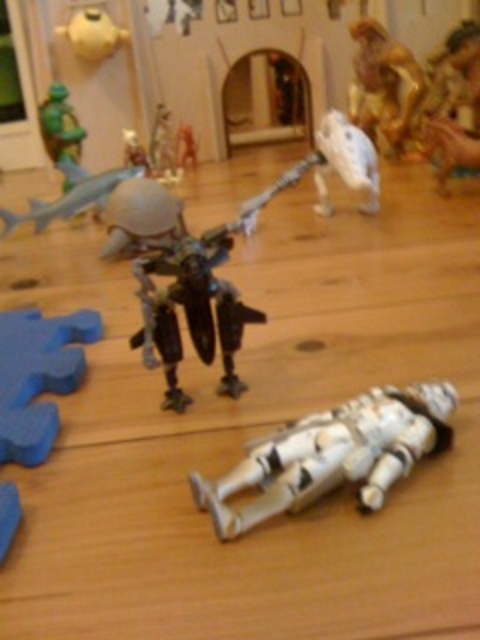
Is white matte elephant at upper center to the right of blue matte shark at upper left from the viewer's perspective?

Indeed, white matte elephant at upper center is positioned on the right side of blue matte shark at upper left.

Measure the distance between point (359, 131) and camera.

The distance of point (359, 131) from camera is 1.34 meters.

Does point (316, 180) come closer to viewer compared to point (16, 221)?

That is False.

The height and width of the screenshot is (640, 480). I want to click on white matte elephant at upper center, so click(x=346, y=163).

Between gold metallic statue at upper right and blue matte shark at upper left, which one is positioned higher?

gold metallic statue at upper right is higher up.

Can you confirm if gold metallic statue at upper right is positioned to the right of blue matte shark at upper left?

Correct, you'll find gold metallic statue at upper right to the right of blue matte shark at upper left.

This screenshot has width=480, height=640. What do you see at coordinates (386, 92) in the screenshot?
I see `gold metallic statue at upper right` at bounding box center [386, 92].

Find the location of a particular element. Image resolution: width=480 pixels, height=640 pixels. gold metallic statue at upper right is located at coordinates (386, 92).

Describe the element at coordinates (334, 454) in the screenshot. I see `white plastic astronaut at lower center` at that location.

From the picture: Between white plastic astronaut at lower center and blue matte shark at upper left, which one has more height?

Standing taller between the two is blue matte shark at upper left.

Is point (377, 497) behind point (98, 189)?

No, it is in front of (98, 189).

Identify the location of white plastic astronaut at lower center. (334, 454).